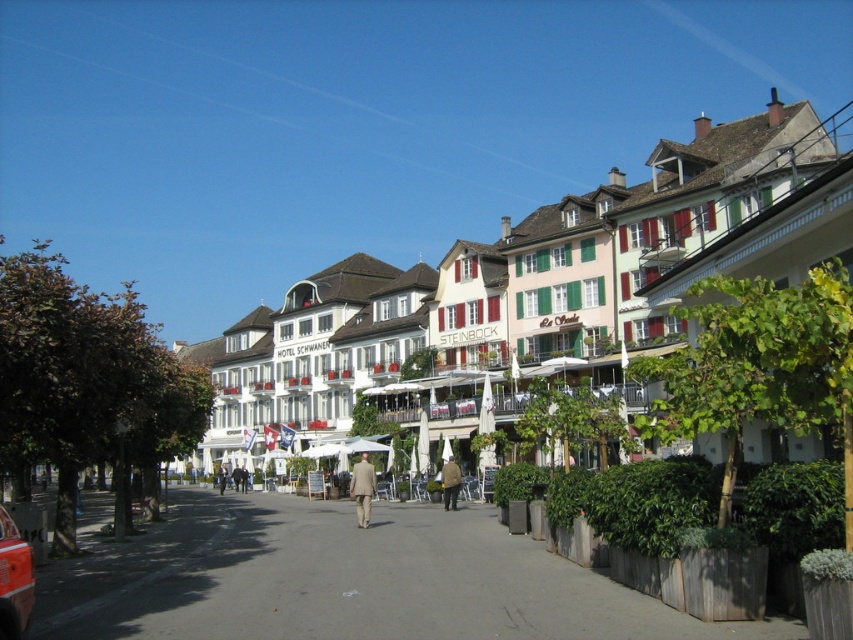
Question: Among these points, which one is nearest to the camera?

Choices:
 (A) (354, 483)
 (B) (3, 588)
 (C) (335, 356)
 (D) (456, 481)

Answer: (B)

Question: Estimate the real-world distances between objects in this image. Which object is closer to the metallic red car at lower left?

Choices:
 (A) light beige suit at center
 (B) white matte building at center

Answer: (A)

Question: Is metallic red car at lower left wider than light beige suit at center?

Choices:
 (A) no
 (B) yes

Answer: (A)

Question: Is metallic red car at lower left to the right of light beige suit at center from the viewer's perspective?

Choices:
 (A) yes
 (B) no

Answer: (B)

Question: Which point is closer to the camera?

Choices:
 (A) (444, 508)
 (B) (9, 609)

Answer: (B)

Question: Observing the image, what is the correct spatial positioning of white matte building at center in reference to brown leather jacket at center?

Choices:
 (A) below
 (B) above

Answer: (B)